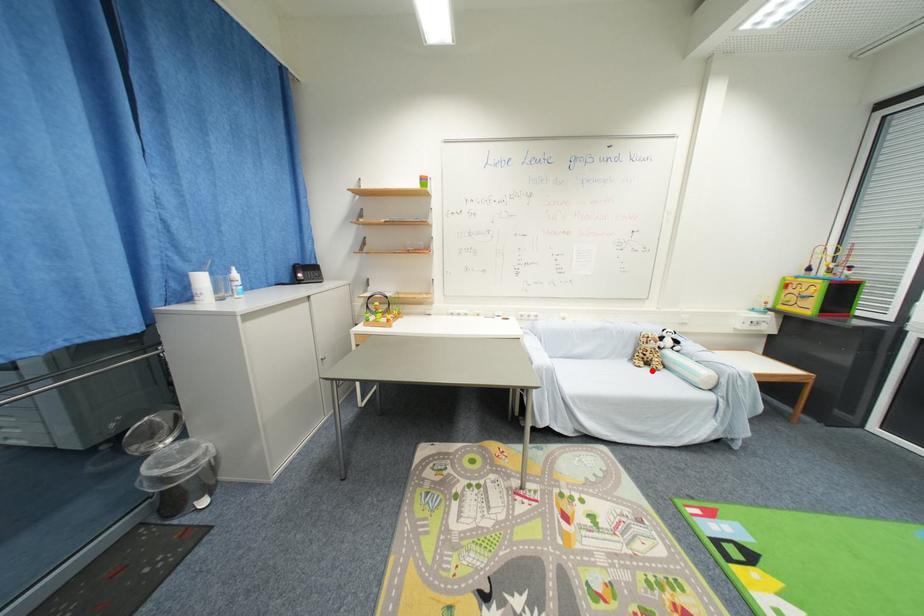
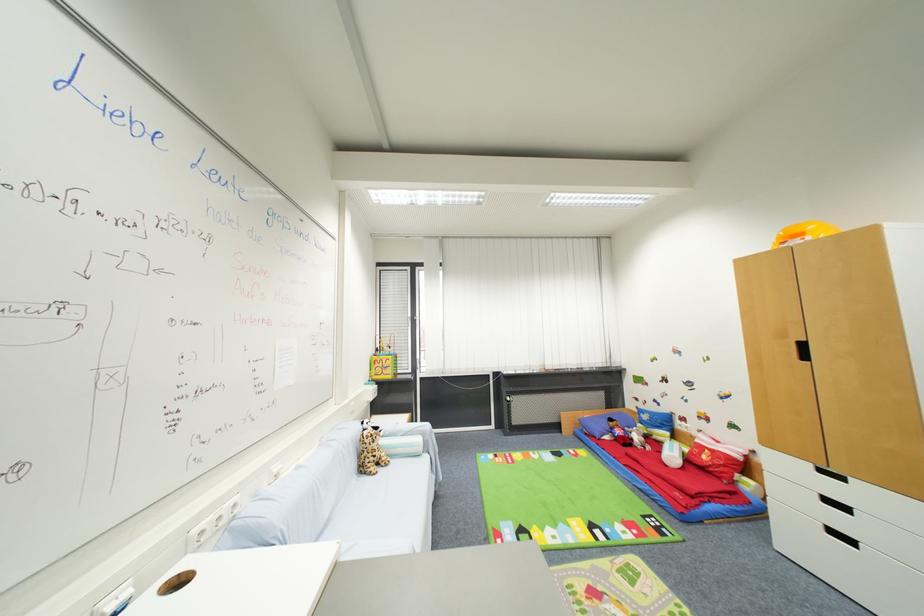
The point at the highlighted location is marked in the first image. Where is the corresponding point in the second image?

(385, 472)